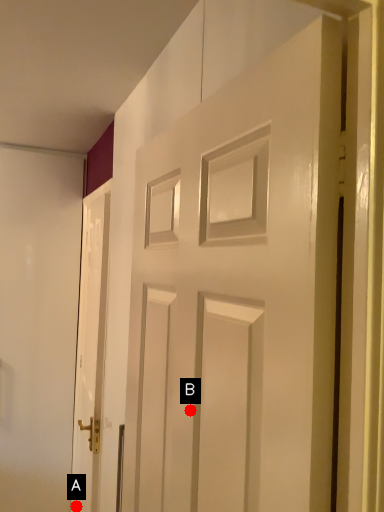
Question: Two points are circled on the image, labeled by A and B beside each circle. Which point is closer to the camera?

Choices:
 (A) A is closer
 (B) B is closer

Answer: (B)